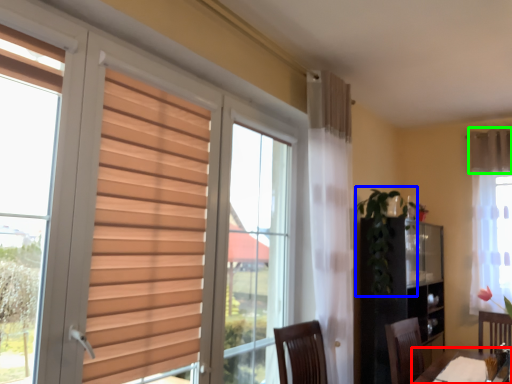
Question: Estimate the real-world distances between objects in this image. Which object is farther from table (highlighted by a red box), plant (highlighted by a blue box) or curtain (highlighted by a green box)?

Choices:
 (A) plant
 (B) curtain

Answer: (B)